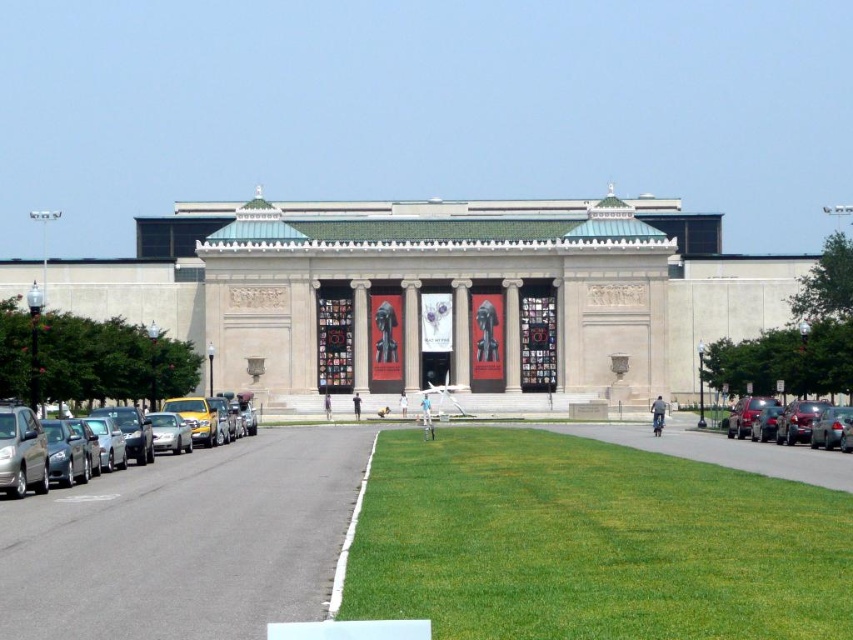
Does green grass at center have a lesser width compared to shiny silver sedan at left?

No.

Who is positioned more to the left, green grass at center or shiny silver sedan at left?

From the viewer's perspective, shiny silver sedan at left appears more on the left side.

This screenshot has height=640, width=853. What do you see at coordinates (592, 541) in the screenshot? I see `green grass at center` at bounding box center [592, 541].

Where is `green grass at center`? This screenshot has width=853, height=640. green grass at center is located at coordinates (592, 541).